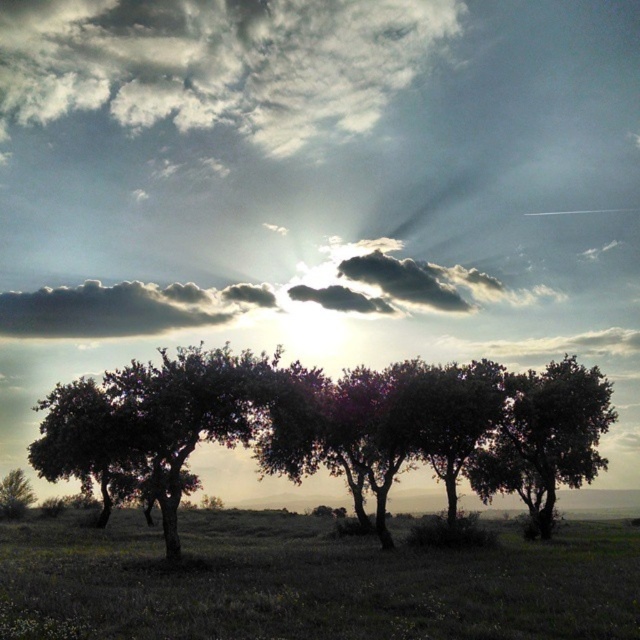
Can you confirm if green grassy at lower center is positioned above green leafy tree at center?

No, green grassy at lower center is not above green leafy tree at center.

Is green grassy at lower center in front of green leafy tree at center?

Yes, it is.

Is point (52, 524) positioned after point (486, 492)?

That is False.

Find the location of a particular element. green grassy at lower center is located at coordinates point(310,582).

Who is more forward, (577, 472) or (13, 499)?

Positioned in front is point (577, 472).

Is silhouette leafy tree at center above green matte tree at lower left?

Correct, silhouette leafy tree at center is located above green matte tree at lower left.

Which is in front, point (566, 420) or point (17, 512)?

Point (566, 420) is more forward.

You are a GUI agent. You are given a task and a screenshot of the screen. Output one action in this format:
    pyautogui.click(x=<x>, y=<y>)
    Task: Click on the silhouette leafy tree at center
    The height and width of the screenshot is (640, 640).
    Given the screenshot: What is the action you would take?
    pyautogui.click(x=323, y=422)

Does green grassy at lower center have a larger size compared to smokey gray cloud at upper center?

Yes.

Which is in front, point (547, 614) or point (392, 282)?

Positioned in front is point (547, 614).

At what (x,y) coordinates should I click in order to perform the action: click on green grassy at lower center. Please return your answer as a coordinate pair (x, y). Looking at the image, I should click on (310, 582).